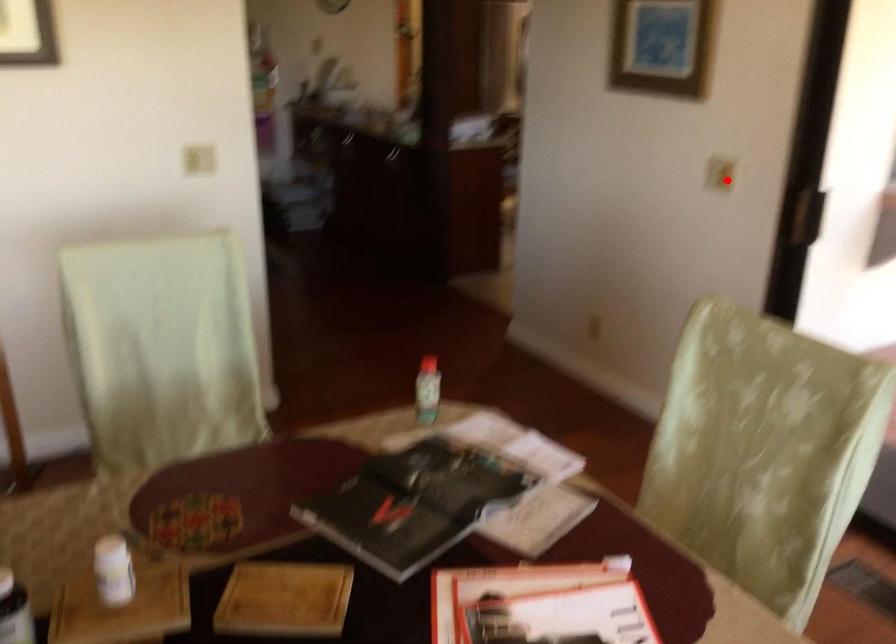
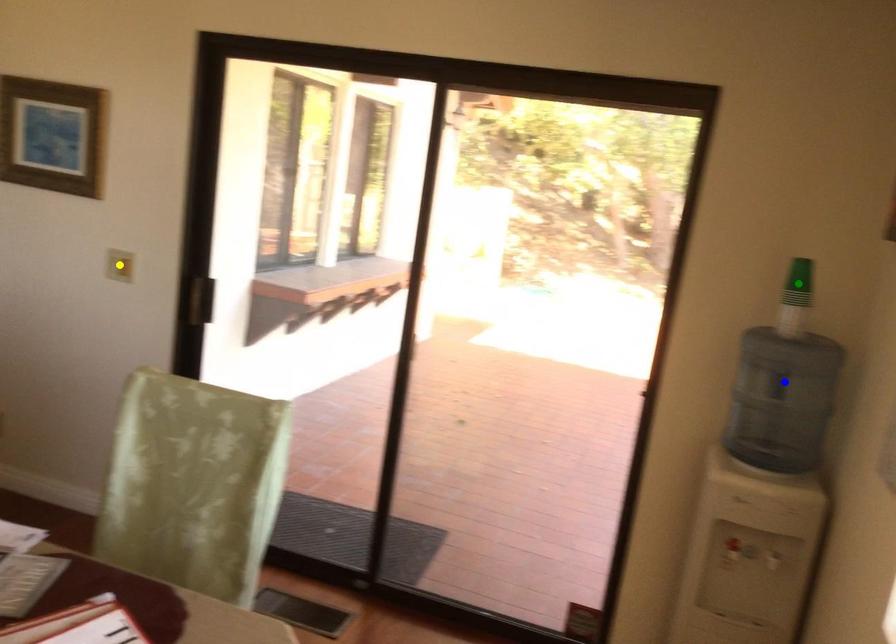
Question: I am providing you with two images of the same scene from different viewpoints. A red point is marked on the first image. You are given multiple points on the second image. Which mark in image 2 goes with the point in image 1?

Choices:
 (A) blue point
 (B) yellow point
 (C) green point

Answer: (B)